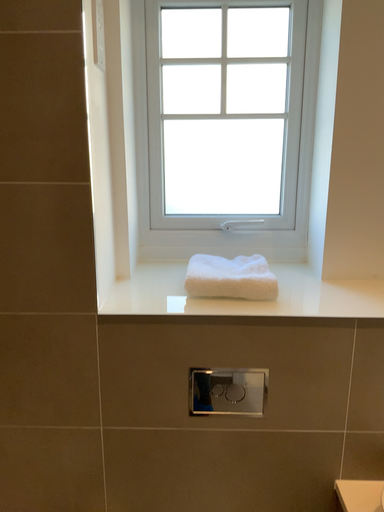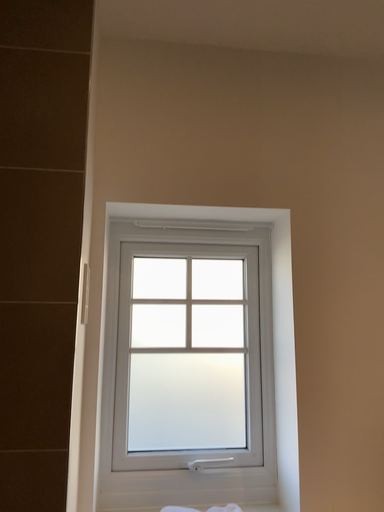
Question: How did the camera likely rotate when shooting the video?

Choices:
 (A) rotated left
 (B) rotated right

Answer: (B)